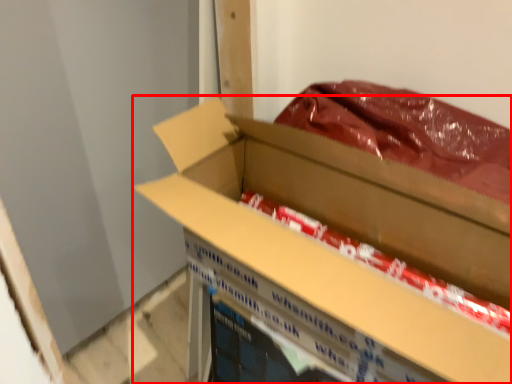
Question: From the image's perspective, considering the relative positions of box (annotated by the red box) and wrapping paper in the image provided, where is box (annotated by the red box) located with respect to the staircase?

Choices:
 (A) above
 (B) below

Answer: (B)